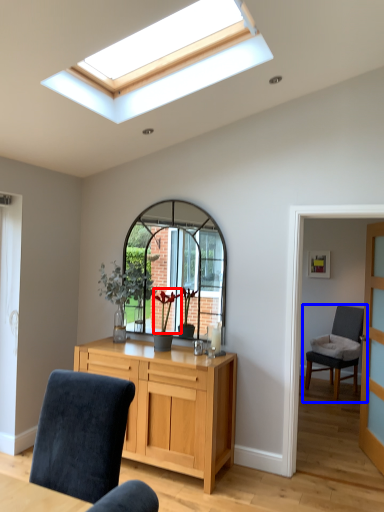
Question: Which object appears closest to the camera in this image, flower (highlighted by a red box) or chair (highlighted by a blue box)?

Choices:
 (A) flower
 (B) chair

Answer: (A)